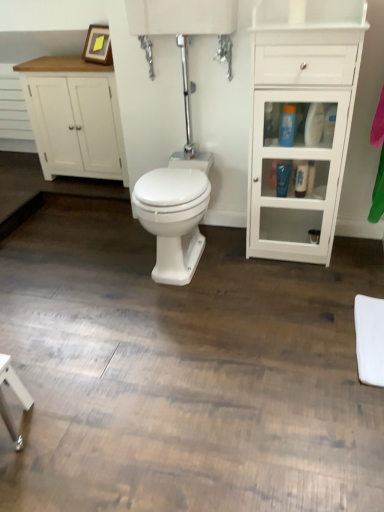
This screenshot has width=384, height=512. I want to click on vacant area that is in front of white glossy bidet at center, so [184, 316].